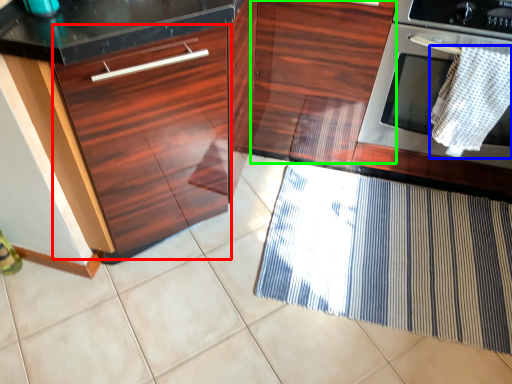
Question: Which is nearer to the drawer (highlighted by a red box)? blanket (highlighted by a blue box) or cabinetry (highlighted by a green box).

Choices:
 (A) blanket
 (B) cabinetry

Answer: (B)